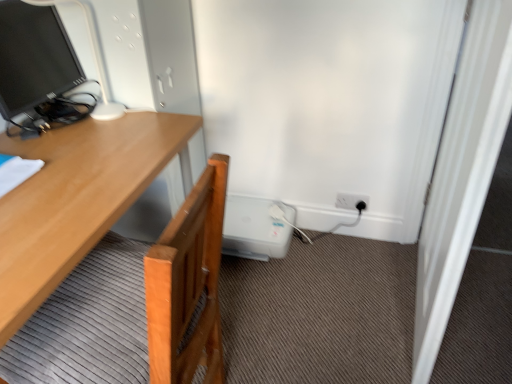
Locate an element on the screen. The height and width of the screenshot is (384, 512). free space above light wood desk at left (from a real-world perspective) is located at coordinates (41, 172).